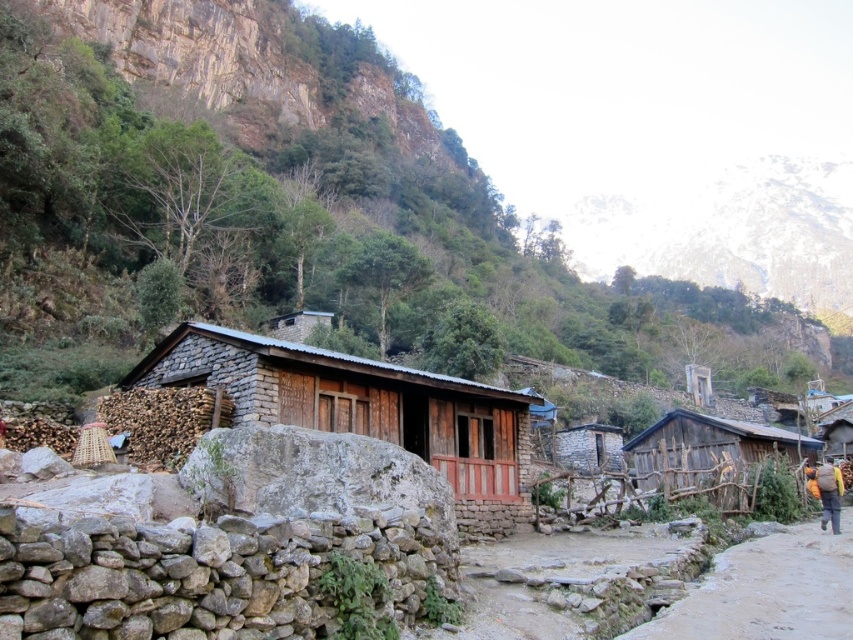
Can you confirm if rough stone mountain at upper left is bigger than wooden hut at center?

Yes, rough stone mountain at upper left is bigger than wooden hut at center.

This screenshot has width=853, height=640. Find the location of `rough stone mountain at upper left`. rough stone mountain at upper left is located at coordinates (367, 204).

Who is shorter, rough stone mountain at upper left or brown fabric backpack at right?

Standing shorter between the two is brown fabric backpack at right.

Locate an element on the screen. This screenshot has width=853, height=640. rough stone mountain at upper left is located at coordinates point(367,204).

Is wooden hut at center taller than dirt path at lower right?

Yes.

Does point (358, 360) come behind point (838, 572)?

Yes, it is.

Who is more distant from viewer, (460, 444) or (670, 630)?

Positioned behind is point (460, 444).

In order to click on wooden hut at center in this screenshot , I will do point(364,408).